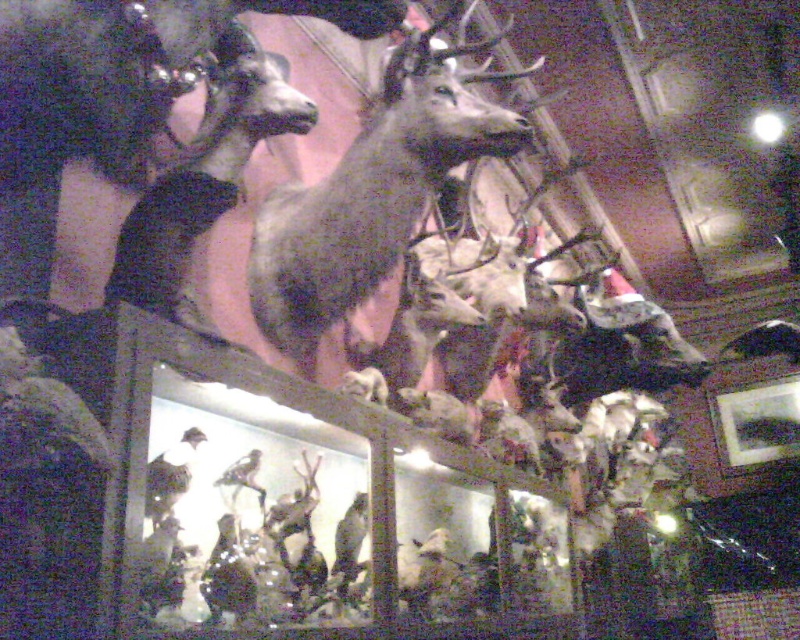
Based on the photo, is shiny brown deer at center below shiny brown deer at upper left?

No.

Can you confirm if shiny brown deer at center is taller than shiny brown deer at upper left?

Correct, shiny brown deer at center is much taller as shiny brown deer at upper left.

Who is more forward, (400, 209) or (168, 291)?

Positioned in front is point (168, 291).

Where is `shiny brown deer at center`? shiny brown deer at center is located at coordinates (372, 193).